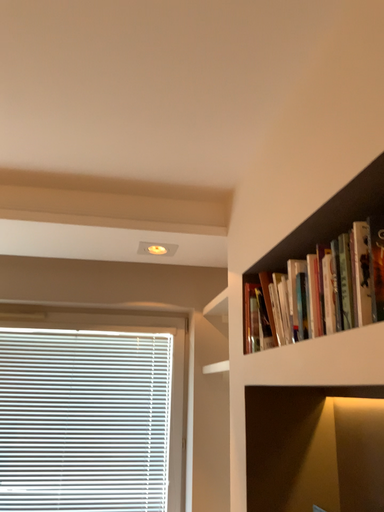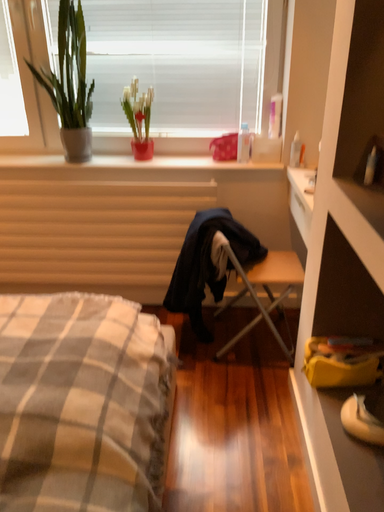
Question: Which way did the camera rotate in the video?

Choices:
 (A) rotated downward
 (B) rotated upward

Answer: (A)